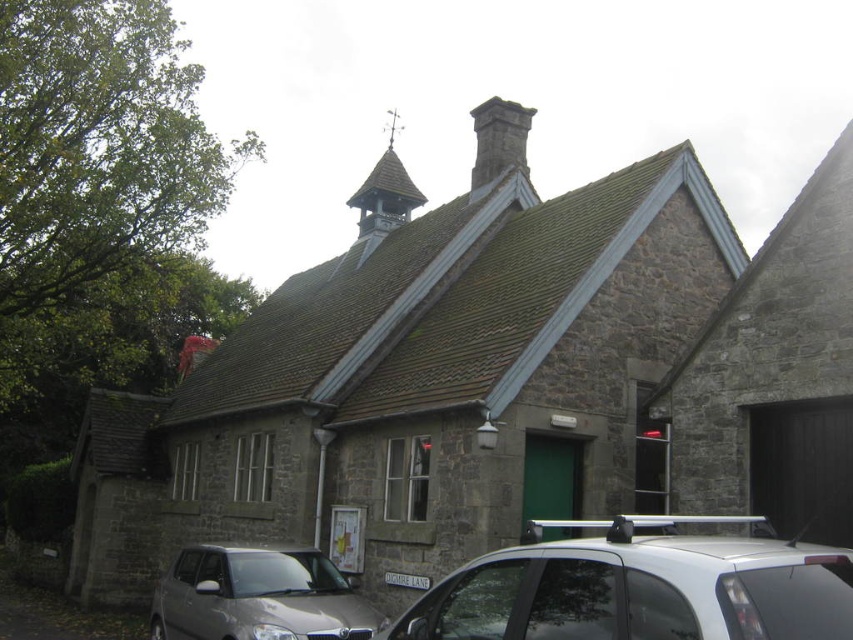
You are standing at the entrance of the stone building and want to park your car. Based on the image, can you determine if the silver metallic car at lower right is positioned near the entrance?

The silver metallic car at lower right is located at point [640,586], which is not near the entrance of the stone building. Therefore, it is positioned farther away from the entrance.

You are standing at the center of the image and want to locate the silver metallic car at lower right. In which direction should you look to find it?

The silver metallic car at lower right is located at the lower right direction from your current position at the center of the image.

You are standing at the entrance of the quaint stone building and want to park your silver metallic car at lower right. Is the point at coordinate (640, 586) on the car?

Yes, the point at coordinate (640, 586) is on the silver metallic car at lower right.